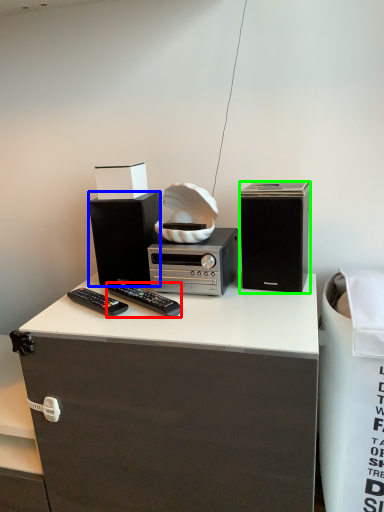
Question: Considering the real-world distances, which object is farthest from remote control (highlighted by a red box)? loudspeaker (highlighted by a blue box) or loudspeaker (highlighted by a green box)?

Choices:
 (A) loudspeaker
 (B) loudspeaker

Answer: (B)